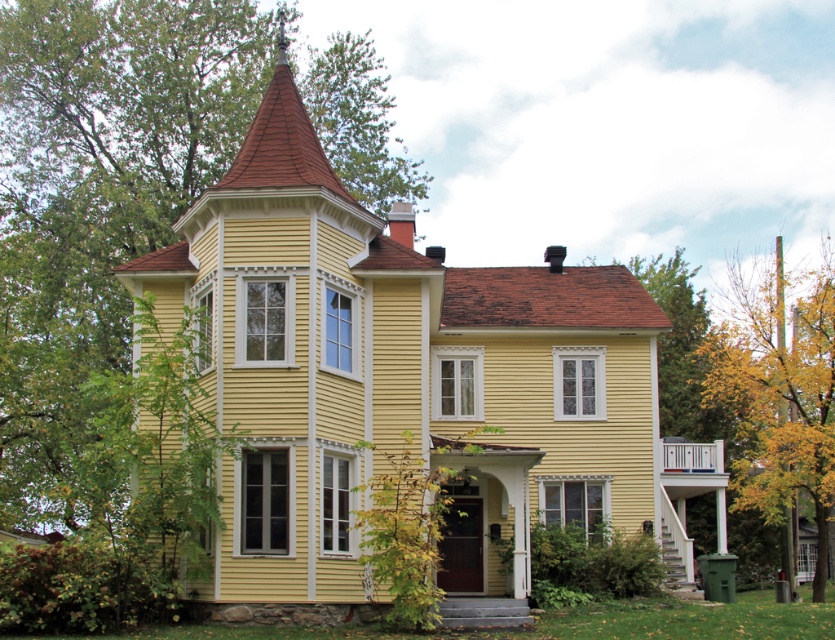
You are standing in front of the house and notice two trees. One is a green leafy tree at upper left and the other is a yellow leafy tree at lower right. Which tree is located to the left of the other?

The green leafy tree at upper left is positioned on the left side of the yellow leafy tree at lower right.

You are standing at the base of the Victorian house and want to know how far you are from the point labeled point (33, 56). Can you determine the distance?

The distance between you and point (33, 56) is 285.57 feet.

You are standing in front of the Victorian house and notice a green leafy tree at upper left. Based on its coordinates, is the tree closer to the top or the bottom of the image?

The green leafy tree at upper left is located at point 0.330 on the x axis and 0.119 on the y axis. Since the y coordinate is closer to 0, which represents the bottom of the image, the tree is closer to the bottom.